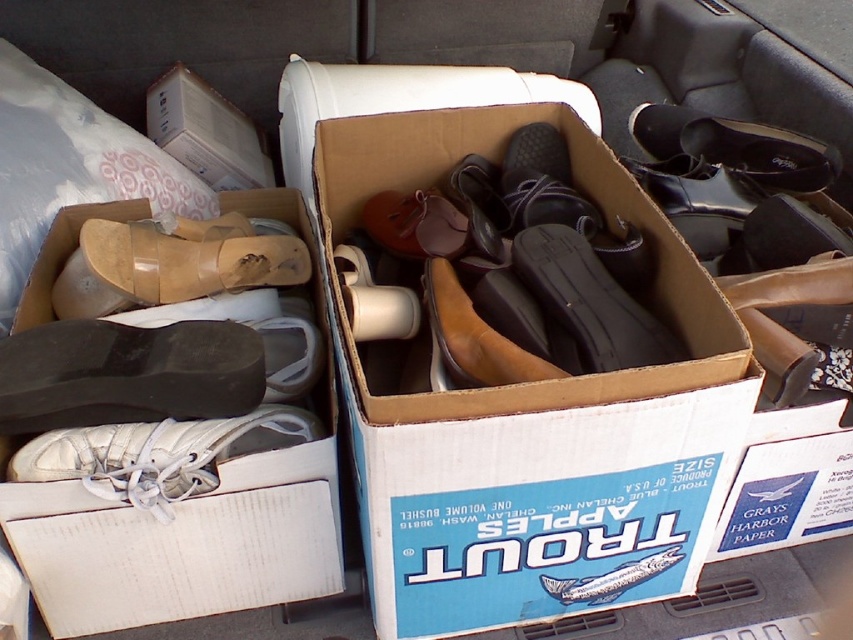
Question: Which of the following is the farthest from the observer?

Choices:
 (A) white leather shoe at lower left
 (B) brown cardboard box at center
 (C) black leather shoe at upper right
 (D) black rubber shoe at center

Answer: (C)

Question: Is brown cardboard box at center to the left of black matte shoe at lower left from the viewer's perspective?

Choices:
 (A) no
 (B) yes

Answer: (A)

Question: Which point is farther to the camera?

Choices:
 (A) white cardboard shoebox at lower left
 (B) white leather shoe at lower left

Answer: (B)

Question: Can you confirm if black rubber shoe at center is thinner than black leather shoe at upper right?

Choices:
 (A) no
 (B) yes

Answer: (B)

Question: Which is nearer to the brown cardboard box at center?

Choices:
 (A) white leather shoe at lower left
 (B) black matte shoe at lower left
 (C) black leather shoe at upper right

Answer: (A)

Question: Does white leather shoe at lower left have a larger size compared to black rubber shoe at center?

Choices:
 (A) no
 (B) yes

Answer: (A)